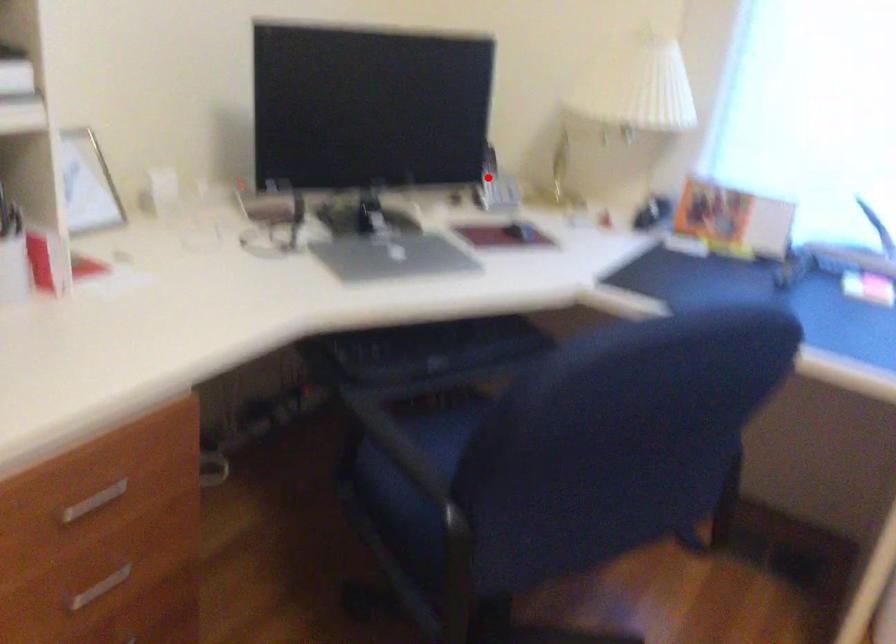
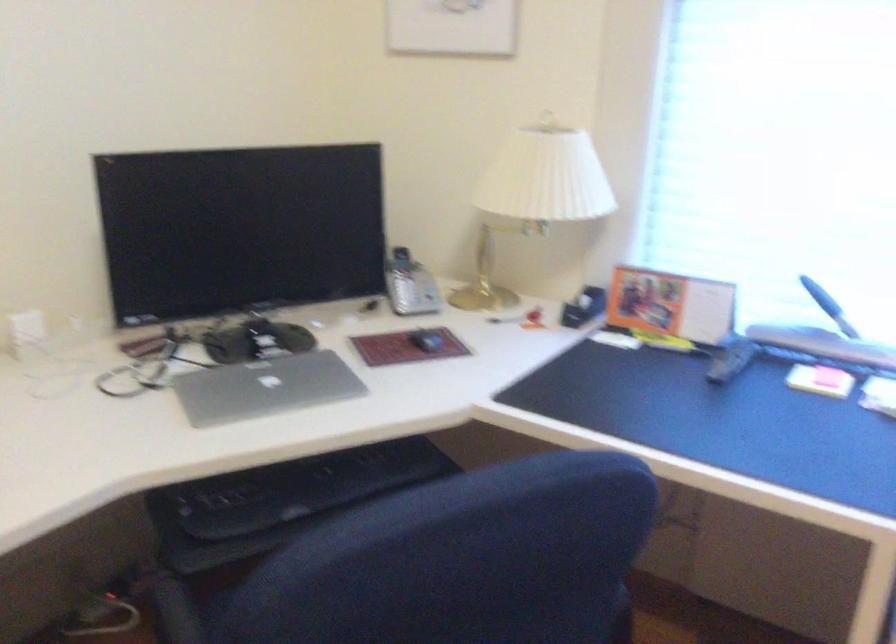
The point at the highlighted location is marked in the first image. Where is the corresponding point in the second image?

(401, 281)